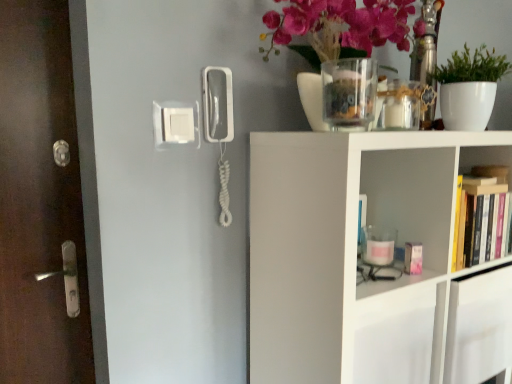
Question: From a real-world perspective, is white matte shelf at upper right, the first shelf in the bottom-to-top sequence, above or below matte glass vase at upper center?

Choices:
 (A) below
 (B) above

Answer: (A)

Question: Considering the positions of white matte shelf at upper right, the first shelf in the bottom-to-top sequence, and matte glass vase at upper center in the image, is white matte shelf at upper right, the first shelf in the bottom-to-top sequence, taller or shorter than matte glass vase at upper center?

Choices:
 (A) short
 (B) tall

Answer: (B)

Question: Which is nearer to the white plastic light switch at upper center?

Choices:
 (A) white matte shelf at upper right, the 2th shelf when ordered from top to bottom
 (B) white matte plant at upper right
 (C) brown wooden door at left
 (D) white plastic phone at center
 (E) hardcover books at right, the first shelf viewed from the top

Answer: (D)

Question: Which object is positioned farthest from the hardcover books at right, which is counted as the second shelf, starting from the bottom?

Choices:
 (A) matte glass vase at upper center
 (B) white plastic phone at center
 (C) white matte shelf at upper right, the 2th shelf when ordered from top to bottom
 (D) clear glass vase at upper center
 (E) white matte plant at upper right

Answer: (B)